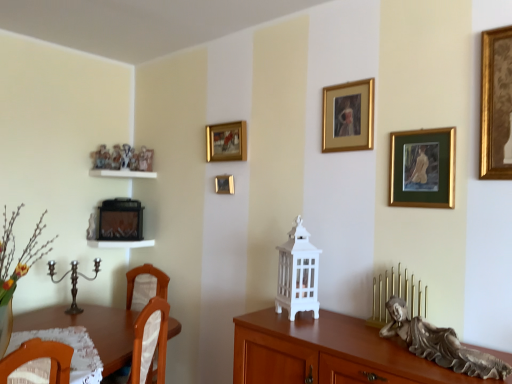
Question: Is white glossy shelf at center, arranged as the first shelf when ordered from the bottom, bigger than polished silver candle holder at lower left, arranged as the first candle holder when viewed from the back?

Choices:
 (A) no
 (B) yes

Answer: (A)

Question: Can you confirm if white glossy shelf at center, which ranks as the second shelf in top-to-bottom order, is wider than polished silver candle holder at lower left, arranged as the first candle holder when viewed from the back?

Choices:
 (A) yes
 (B) no

Answer: (A)

Question: From a real-world perspective, is white glossy shelf at center, which ranks as the second shelf in top-to-bottom order, located beneath polished silver candle holder at lower left, the 2th candle holder in the front-to-back sequence?

Choices:
 (A) yes
 (B) no

Answer: (B)

Question: Can we say white glossy shelf at center, which ranks as the second shelf in top-to-bottom order, lies outside polished silver candle holder at lower left, arranged as the 1th candle holder when viewed from the left?

Choices:
 (A) no
 (B) yes

Answer: (B)

Question: Is the position of white glossy shelf at center, which ranks as the second shelf in top-to-bottom order, more distant than that of polished silver candle holder at lower left, positioned as the second candle holder in right-to-left order?

Choices:
 (A) yes
 (B) no

Answer: (A)

Question: Does white glossy shelf at center, arranged as the first shelf when ordered from the bottom, appear on the left side of polished silver candle holder at lower left, the 2th candle holder in the front-to-back sequence?

Choices:
 (A) yes
 (B) no

Answer: (B)

Question: Are polished silver candle holder at lower left, positioned as the second candle holder in right-to-left order, and white glossy shelf at center, which ranks as the second shelf in top-to-bottom order, beside each other?

Choices:
 (A) yes
 (B) no

Answer: (B)

Question: From a real-world perspective, is polished silver candle holder at lower left, arranged as the 1th candle holder when viewed from the left, beneath white glossy shelf at center, arranged as the first shelf when ordered from the bottom?

Choices:
 (A) no
 (B) yes

Answer: (B)

Question: Is polished silver candle holder at lower left, arranged as the 1th candle holder when viewed from the left, surrounding white glossy shelf at center, which ranks as the second shelf in top-to-bottom order?

Choices:
 (A) no
 (B) yes

Answer: (A)

Question: Considering the relative sizes of polished silver candle holder at lower left, the 2th candle holder in the front-to-back sequence, and white glossy shelf at center, which ranks as the second shelf in top-to-bottom order, in the image provided, is polished silver candle holder at lower left, the 2th candle holder in the front-to-back sequence, thinner than white glossy shelf at center, which ranks as the second shelf in top-to-bottom order,?

Choices:
 (A) yes
 (B) no

Answer: (A)

Question: Does polished silver candle holder at lower left, arranged as the 1th candle holder when viewed from the left, have a larger size compared to white glossy shelf at center, arranged as the first shelf when ordered from the bottom?

Choices:
 (A) no
 (B) yes

Answer: (B)

Question: Does polished silver candle holder at lower left, the 2th candle holder in the front-to-back sequence, have a greater height compared to white glossy shelf at center, arranged as the first shelf when ordered from the bottom?

Choices:
 (A) yes
 (B) no

Answer: (A)

Question: Is white glossy shelf at center, which ranks as the second shelf in top-to-bottom order, closer to the viewer compared to white glossy shelf at upper left, the first shelf in the top-to-bottom sequence?

Choices:
 (A) yes
 (B) no

Answer: (A)